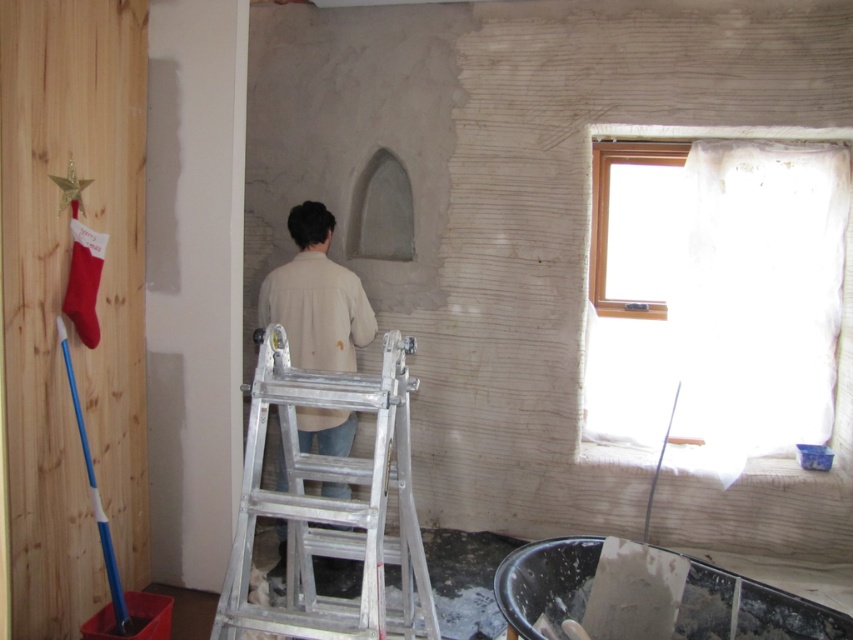
You are a painter trying to reach the window at upper right. You see an aluminum ladder at center and a transparent plastic window at upper right. Which object is closer to the window at upper right?

The aluminum ladder at center is to the left of the transparent plastic window at upper right, so the transparent plastic window at upper right is closer to itself. Wait, that doesn t make sense. Maybe rephrase. The aluminum ladder is to the left of the window, so the window is closer to itself. Hmm, perhaps the answer should state that the ladder is to the left of the window, so the window is the closest object to itself. Alternatively, maybe the question is phrased incorrectly. Let me check the rules. The

You are a painter trying to reach the top of the wall. You have an aluminum ladder at center and a light beige shirt at center. Which object can provide a wider base for stability?

The aluminum ladder at center has a larger width than the light beige shirt at center, so it provides a wider base for stability.